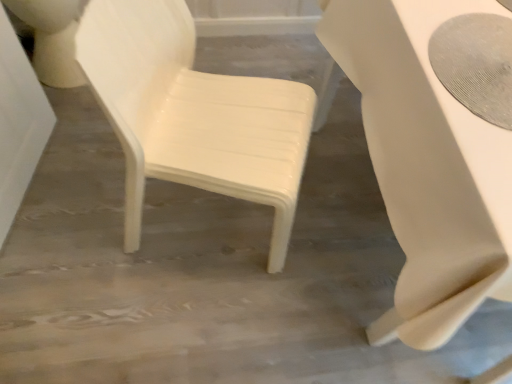
At what (x,y) coordinates should I click in order to perform the action: click on free space in front of white glossy chair at center. Please return your answer as a coordinate pair (x, y). This screenshot has width=512, height=384. Looking at the image, I should click on (184, 317).